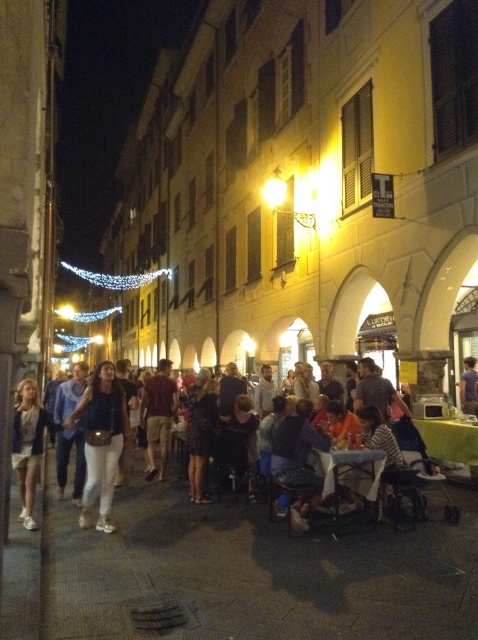
You are a photographer positioned at the lower left corner of the street scene. You notice the matte black top at center and the light beige denim jacket at lower left in your view. Which object is positioned to the right of the other?

A: The matte black top at center is positioned to the right of the light beige denim jacket at lower left.

You are standing on the street and want to walk towards the two points marked in the image. Which point, point (106, 513) or point (32, 474), will you reach first?

Point (106, 513) is closer to the viewer than point (32, 474), so you will reach point (106, 513) first.